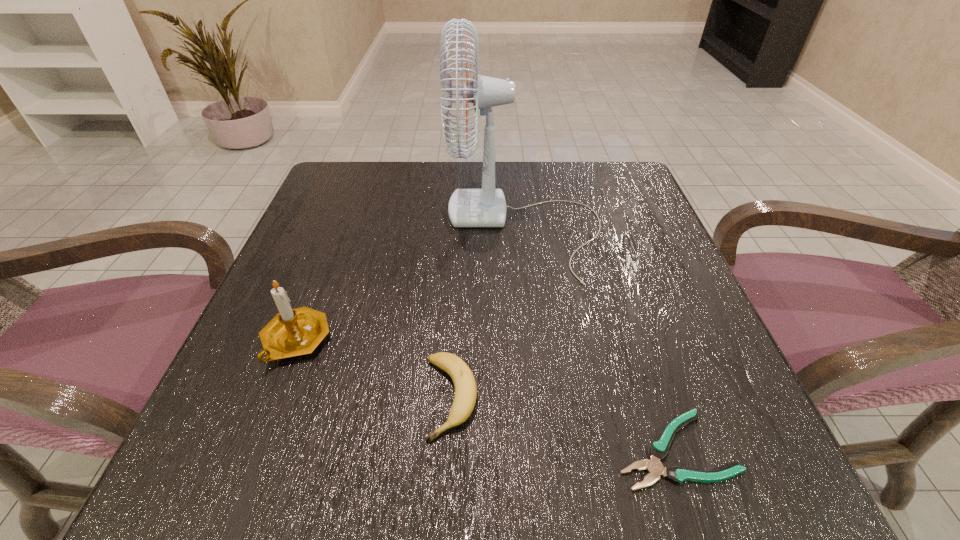
Where is `fan`? The height and width of the screenshot is (540, 960). fan is located at coordinates (468, 208).

The width and height of the screenshot is (960, 540). I want to click on the farthest object, so click(x=468, y=208).

Image resolution: width=960 pixels, height=540 pixels. I want to click on the leftmost object, so click(292, 332).

Identify the location of candle holder. (292, 332).

This screenshot has width=960, height=540. What are the coordinates of `the third tallest object` in the screenshot? It's located at (465, 396).

This screenshot has width=960, height=540. Identify the location of the shortest object. (658, 450).

Locate an element on the screen. free space located 0.180m on the front-facing side of the tallest object is located at coordinates (360, 227).

In order to click on free location located 0.140m on the front-facing side of the tallest object in this screenshot , I will do `click(379, 227)`.

At what (x,y) coordinates should I click in order to perform the action: click on free region located 0.290m on the front-facing side of the tallest object. Please return your answer as a coordinate pair (x, y). This screenshot has width=960, height=540. Looking at the image, I should click on (306, 227).

In order to click on vacant region located on the right of the candle holder in this screenshot , I will do `click(388, 341)`.